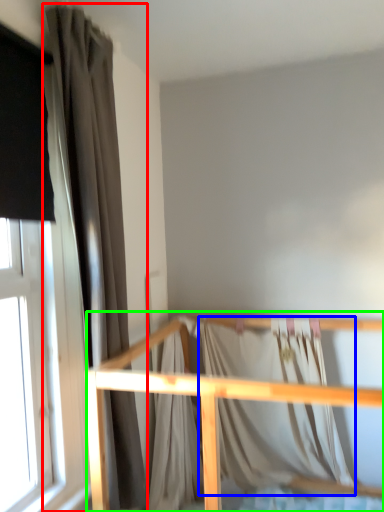
Question: Estimate the real-world distances between objects in this image. Which object is farther from curtain (highlighted by a red box), blanket (highlighted by a blue box) or rail (highlighted by a green box)?

Choices:
 (A) blanket
 (B) rail

Answer: (A)